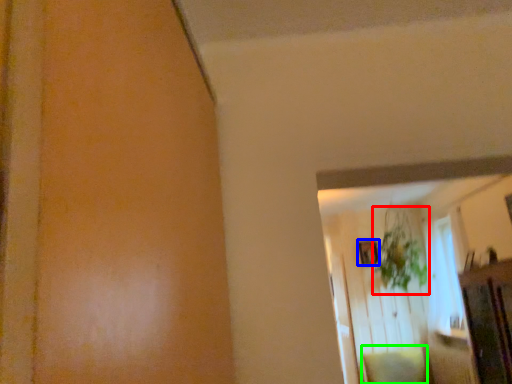
Question: Which object is positioned farthest from plant (highlighted by a red box)? Select from picture frame (highlighted by a blue box) and pillow (highlighted by a green box).

Choices:
 (A) picture frame
 (B) pillow

Answer: (B)